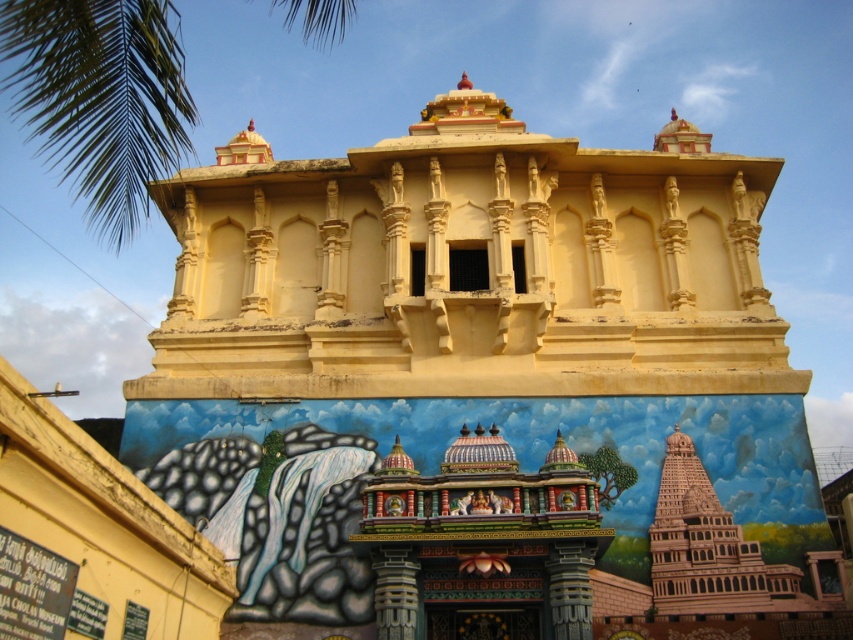
Question: Which point appears closest to the camera in this image?

Choices:
 (A) (618, 148)
 (B) (78, 154)

Answer: (B)

Question: Which point is farther to the camera?

Choices:
 (A) green leafy palm tree at upper left
 (B) matte yellow hindu temple at center

Answer: (B)

Question: Can you confirm if matte yellow hindu temple at center is positioned to the right of green leafy palm tree at upper left?

Choices:
 (A) yes
 (B) no

Answer: (A)

Question: Can you confirm if matte yellow hindu temple at center is thinner than green leafy palm tree at upper left?

Choices:
 (A) yes
 (B) no

Answer: (A)

Question: Is matte yellow hindu temple at center below green leafy palm tree at upper left?

Choices:
 (A) yes
 (B) no

Answer: (A)

Question: Which of the following is the farthest from the observer?

Choices:
 (A) (352, 198)
 (B) (338, 10)

Answer: (B)